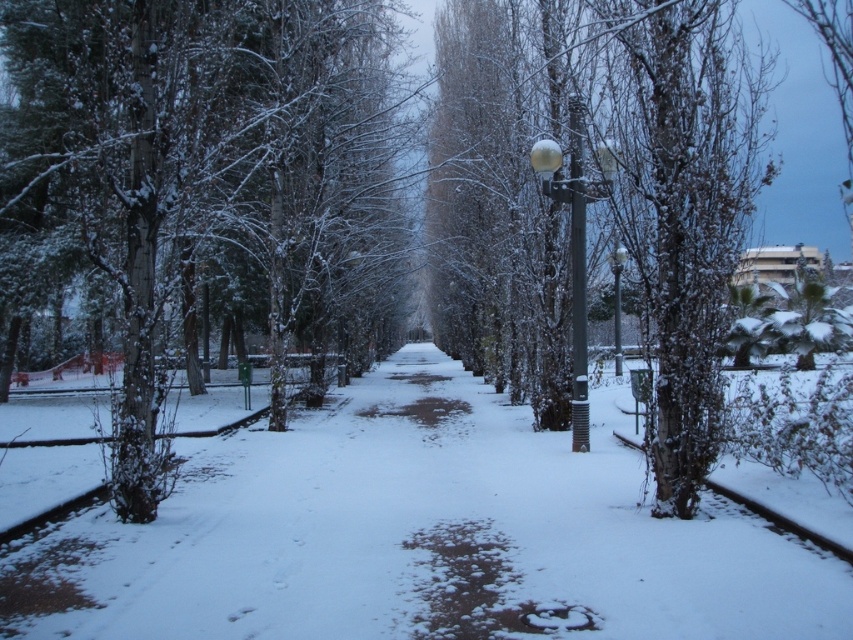
You are standing at the point labeled point (299, 56) and want to walk to the point labeled point (613, 320). Given that the path between them is partially covered in snow and some areas have melted, which direction should you head to reach your destination?

Since point (299, 56) is closer to the viewer than point (613, 320), you should head away from the viewer to reach your destination.